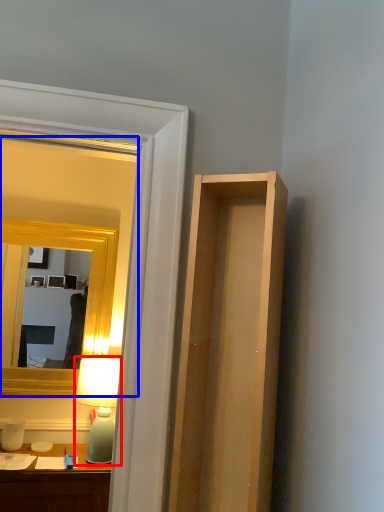
Question: Which point is further to the camera, table lamp (highlighted by a red box) or mirror (highlighted by a blue box)?

Choices:
 (A) table lamp
 (B) mirror

Answer: (B)